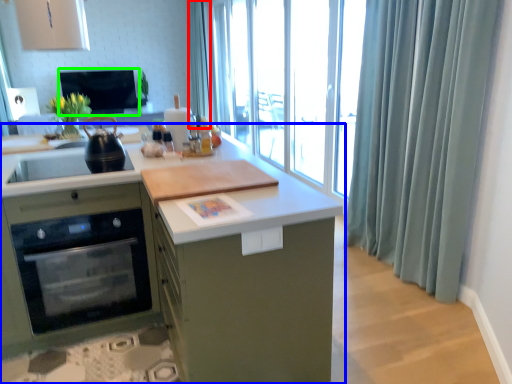
Question: Based on their relative distances, which object is farther from shower curtain (highlighted by a red box)? Choose from cabinetry (highlighted by a blue box) and window screen (highlighted by a green box).

Choices:
 (A) cabinetry
 (B) window screen

Answer: (A)